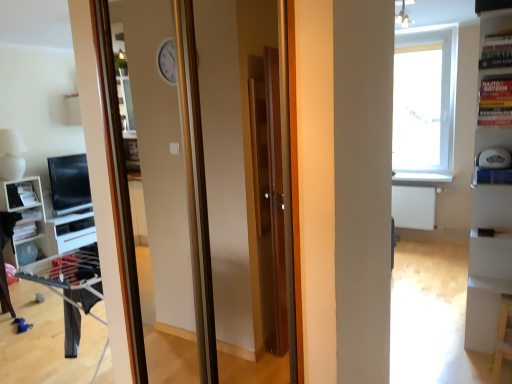
Question: Looking at their shapes, would you say white glossy shelf at left is wider or thinner than transparent glass window at upper right?

Choices:
 (A) thin
 (B) wide

Answer: (B)

Question: Based on their positions, is white glossy shelf at left located to the left or right of transparent glass window at upper right?

Choices:
 (A) left
 (B) right

Answer: (A)

Question: Estimate the real-world distances between objects in this image. Which object is farther from the white glossy shelf at left?

Choices:
 (A) matte black monitor at left
 (B) transparent glass window at upper right
 (C) white glossy bookshelf at right

Answer: (B)

Question: Based on their relative distances, which object is nearer to the white glossy shelf at left?

Choices:
 (A) transparent glass window at upper right
 (B) matte black monitor at left
 (C) white glossy bookshelf at right

Answer: (B)